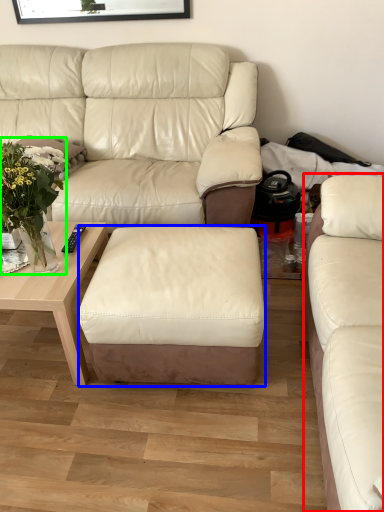
Question: Estimate the real-world distances between objects in this image. Which object is closer to studio couch (highlighted by a red box), stool (highlighted by a blue box) or floral arrangement (highlighted by a green box)?

Choices:
 (A) stool
 (B) floral arrangement

Answer: (A)